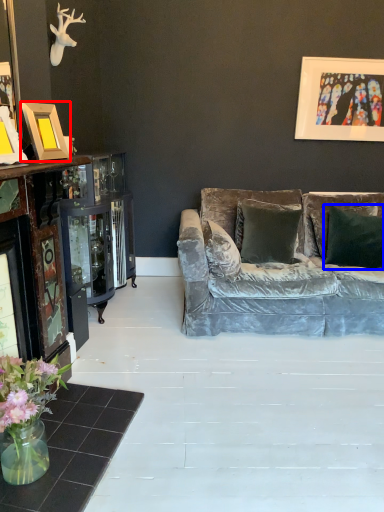
Question: Among these objects, which one is nearest to the camera, picture frame (highlighted by a red box) or pillow (highlighted by a blue box)?

Choices:
 (A) picture frame
 (B) pillow

Answer: (A)